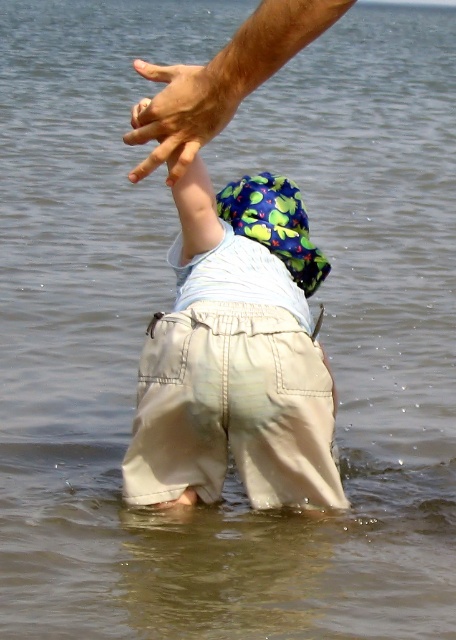
The width and height of the screenshot is (456, 640). Describe the element at coordinates (233, 410) in the screenshot. I see `khaki cotton shorts at center` at that location.

Which of these two, khaki cotton shorts at center or smooth tan skin at upper center, stands taller?

smooth tan skin at upper center is taller.

Find the location of `khaki cotton shorts at center`. khaki cotton shorts at center is located at coordinates (233, 410).

You are a GUI agent. You are given a task and a screenshot of the screen. Output one action in this format:
    pyautogui.click(x=<x>, y=<y>)
    Task: Click on the khaki cotton shorts at center
    This screenshot has height=640, width=456.
    Given the screenshot: What is the action you would take?
    pyautogui.click(x=233, y=410)

Who is shorter, smooth tan skin at upper center or smooth skin hand at upper center?

smooth tan skin at upper center is shorter.

Does smooth tan skin at upper center have a greater width compared to smooth skin hand at upper center?

Correct, the width of smooth tan skin at upper center exceeds that of smooth skin hand at upper center.

Where is `smooth tan skin at upper center`? smooth tan skin at upper center is located at coordinates (222, 81).

This screenshot has width=456, height=640. What do you see at coordinates (233, 410) in the screenshot?
I see `khaki cotton shorts at center` at bounding box center [233, 410].

Who is more distant from viewer, (138, 417) or (162, 118)?

Point (138, 417)

What are the coordinates of `khaki cotton shorts at center` in the screenshot? It's located at (233, 410).